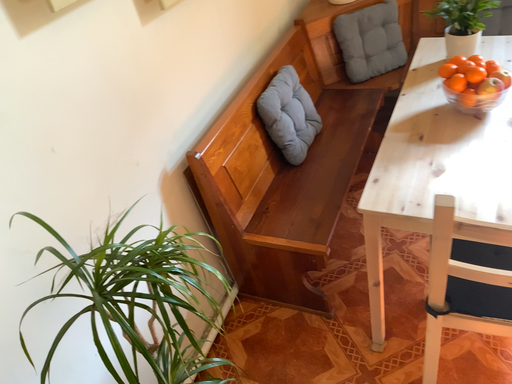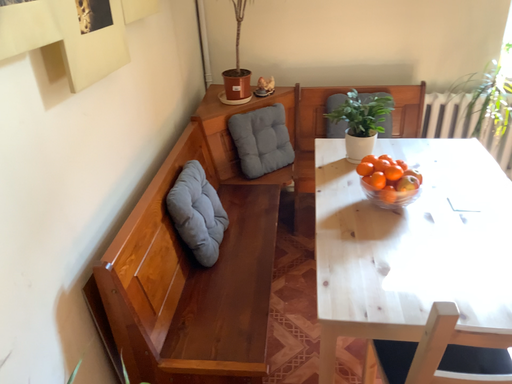
Question: Which way did the camera rotate in the video?

Choices:
 (A) rotated upward
 (B) rotated downward

Answer: (A)